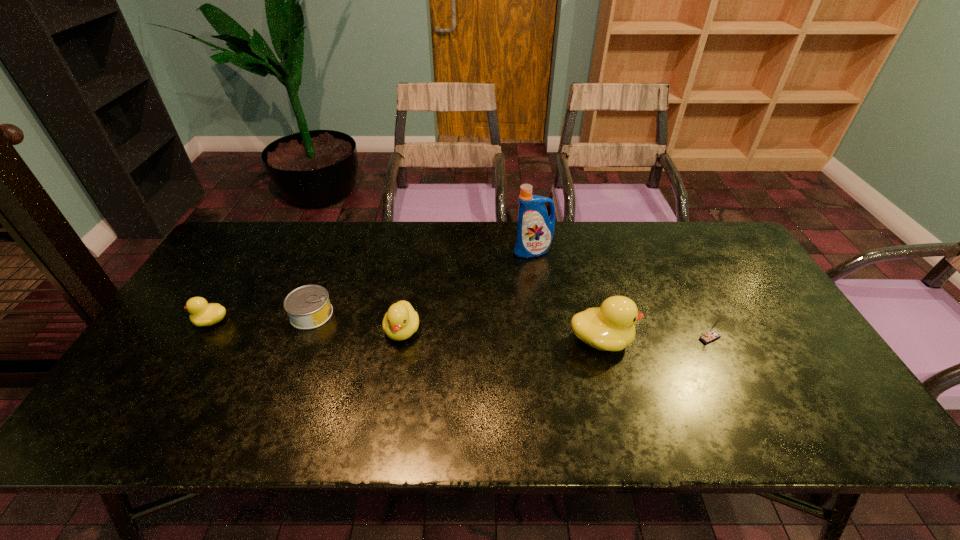
This screenshot has width=960, height=540. Find the location of `the shortest object`. the shortest object is located at coordinates (308, 307).

I want to click on free space located 0.060m on the beak of the leftmost object, so click(x=171, y=321).

The height and width of the screenshot is (540, 960). In order to click on free spot located 0.160m on the beak of the second tallest duckling in this screenshot , I will do `click(390, 403)`.

You are a GUI agent. You are given a task and a screenshot of the screen. Output one action in this format:
    pyautogui.click(x=<x>, y=<y>)
    Task: Click on the vacant space situated on the beak of the rightmost duckling
    Image resolution: width=960 pixels, height=540 pixels.
    Given the screenshot: What is the action you would take?
    pyautogui.click(x=727, y=340)

This screenshot has height=540, width=960. In order to click on free space located 0.180m on the label of the detergent in this screenshot , I will do `click(540, 298)`.

The image size is (960, 540). Find the location of `vacant position located 0.290m on the back of the rightmost object`. vacant position located 0.290m on the back of the rightmost object is located at coordinates (x=671, y=261).

Find the location of a particular element. This screenshot has width=960, height=540. free spot located 0.130m on the right of the can is located at coordinates (379, 314).

Where is `object that is at the far edge`? This screenshot has width=960, height=540. object that is at the far edge is located at coordinates pos(535,230).

Where is `object at the left edge`? This screenshot has width=960, height=540. object at the left edge is located at coordinates (202, 313).

Where is `free space at the far edge`? The height and width of the screenshot is (540, 960). free space at the far edge is located at coordinates (322, 253).